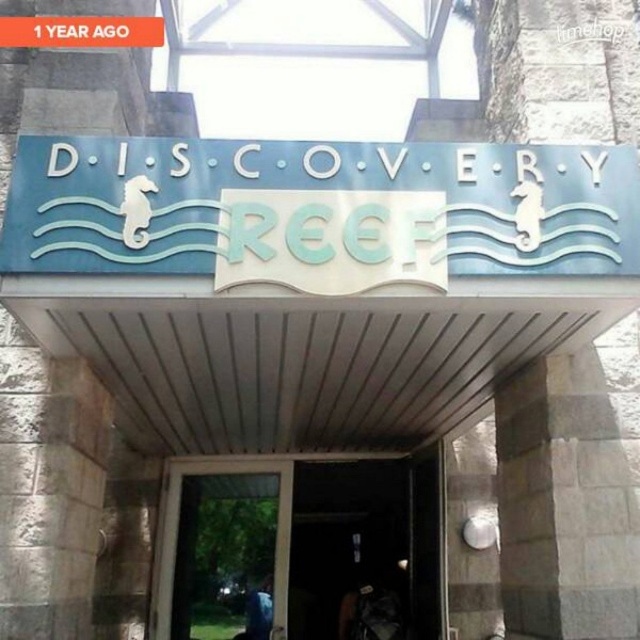
Who is shorter, blue matte sign at upper center or transparent glass door at center?

blue matte sign at upper center

Which is more to the right, blue matte sign at upper center or transparent glass door at center?

blue matte sign at upper center is more to the right.

You are a GUI agent. You are given a task and a screenshot of the screen. Output one action in this format:
    pyautogui.click(x=<x>, y=<y>)
    Task: Click on the blue matte sign at upper center
    The image size is (640, 640).
    Given the screenshot: What is the action you would take?
    pyautogui.click(x=320, y=211)

Does blue matte sign at upper center lie in front of blue metallic sign at upper center?

Yes, blue matte sign at upper center is in front of blue metallic sign at upper center.

Looking at this image, who is positioned more to the right, blue matte sign at upper center or blue metallic sign at upper center?

blue matte sign at upper center is more to the right.

What do you see at coordinates (320, 211) in the screenshot?
I see `blue matte sign at upper center` at bounding box center [320, 211].

What are the coordinates of `blue matte sign at upper center` in the screenshot? It's located at (320, 211).

Is transparent glass door at center to the right of blue metallic sign at upper center from the viewer's perspective?

Correct, you'll find transparent glass door at center to the right of blue metallic sign at upper center.

Is transparent glass door at center below blue metallic sign at upper center?

Yes, transparent glass door at center is below blue metallic sign at upper center.

Where is `transparent glass door at center`? The height and width of the screenshot is (640, 640). transparent glass door at center is located at coordinates (301, 548).